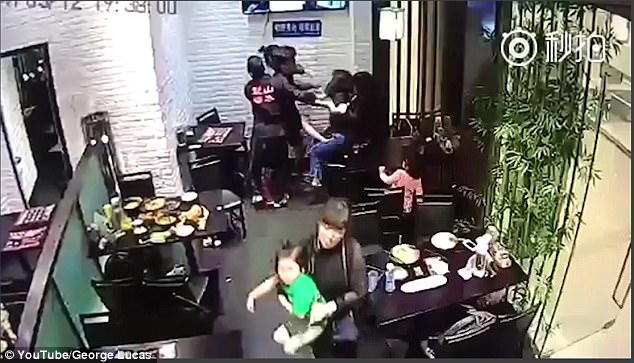
Identify the location of wall. (120, 67), (67, 260), (432, 59), (577, 172).